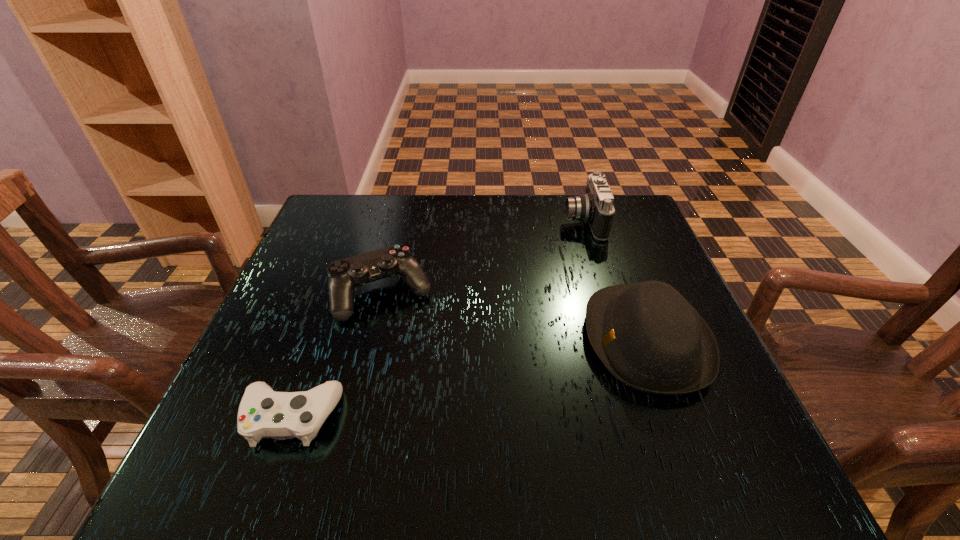
Where is `free location located on the front-facing side of the fedora`? This screenshot has height=540, width=960. free location located on the front-facing side of the fedora is located at coordinates (469, 340).

The image size is (960, 540). What are the coordinates of `vacant region located on the front-facing side of the fedora` in the screenshot? It's located at (499, 340).

The height and width of the screenshot is (540, 960). Identify the location of vacant space positioned on the right of the farther control. (597, 294).

Identify the location of vacant area situated 0.200m on the right of the nearer control. Image resolution: width=960 pixels, height=540 pixels. (457, 417).

This screenshot has width=960, height=540. I want to click on object situated at the far edge, so click(x=596, y=208).

Where is `object located in the near edge section of the desktop`? The image size is (960, 540). object located in the near edge section of the desktop is located at coordinates point(263,413).

This screenshot has width=960, height=540. I want to click on camera that is positioned at the right edge, so click(x=596, y=208).

You are a GUI agent. You are given a task and a screenshot of the screen. Output one action in this format:
    pyautogui.click(x=<x>, y=<y>)
    Task: Click on the fedora present at the right edge
    
    Given the screenshot: What is the action you would take?
    pyautogui.click(x=649, y=337)

Image resolution: width=960 pixels, height=540 pixels. I want to click on object that is positioned at the near left corner, so click(263, 413).

Find the location of a particular element. object that is at the far right corner is located at coordinates (596, 208).